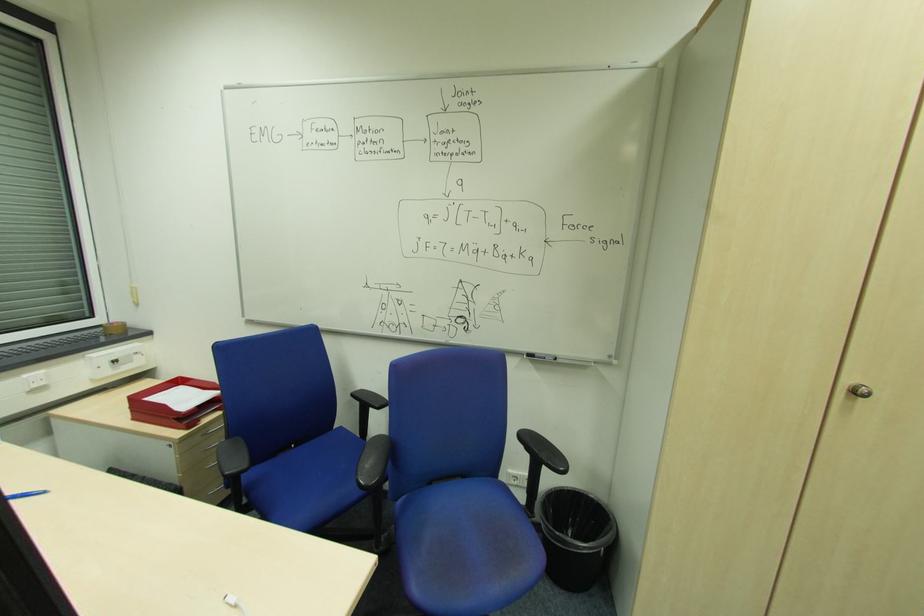
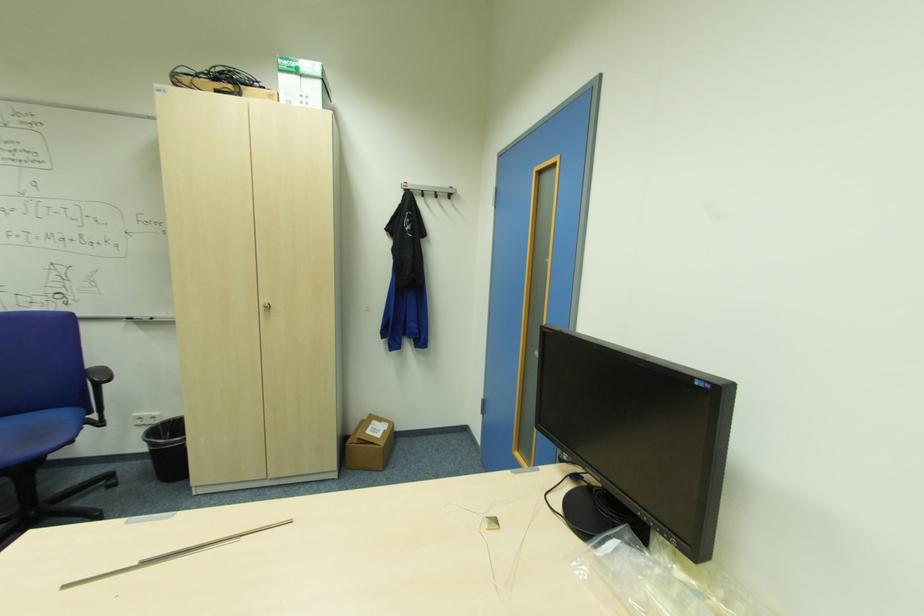
Find the pixel in the second image that matches (x=860, y=392) in the first image.

(271, 307)